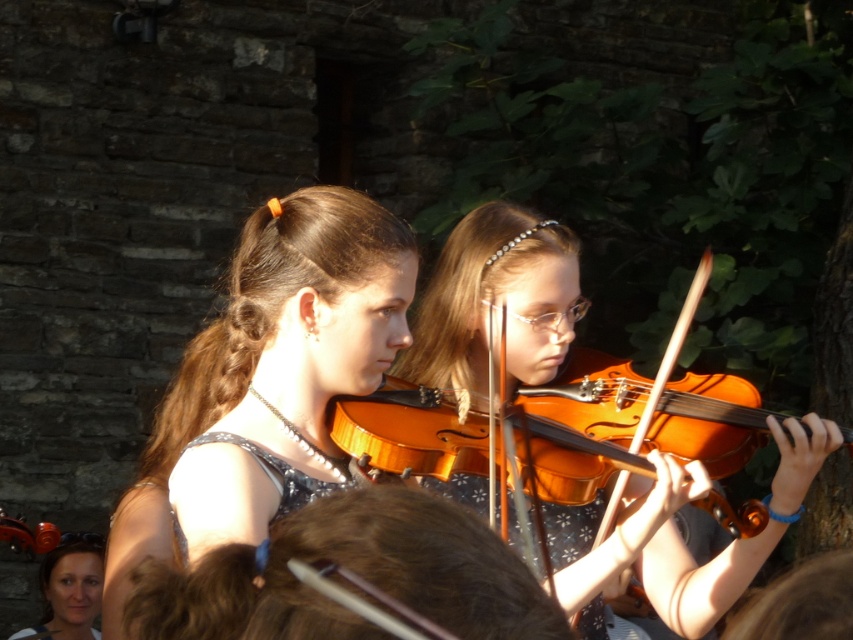
You are a photographer capturing the two girls playing violins. You notice the matte orange violin at center and the sparkly silver dress at center. Which object is closer to the camera?

The matte orange violin at center is positioned over the sparkly silver dress at center, meaning it is closer to the camera.

You are a photographer trying to capture the matte orange violin at center in your shot. The camera is positioned at point A, which is at coordinates 0.3, 0.4. To ensure the violin is centered in the frame, should you move the camera closer to the left or the right? Please provide your answer based on the coordinates provided.

The matte orange violin at center is located at point [474,346]. Since the camera is at [340,192], which is to the left and lower than the violin, you should move the camera slightly to the right and upward to center the violin in the frame.

You are standing in front of the two girls playing violins. You notice two points marked in the scene. The first point is at coordinate point (604, 499) and the second is at point (183, 548). Which of these two points is closer to you?

Point (604, 499) is closer to you because it is further to the viewer than point (183, 548).